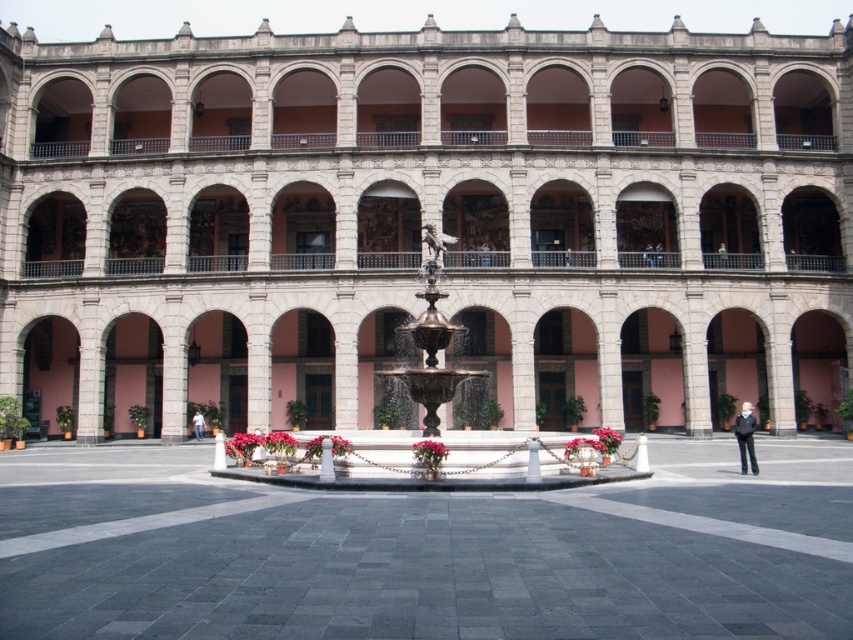
Who is higher up, bronze statue at center or red matte flower at center?

bronze statue at center is higher up.

Is bronze statue at center closer to the viewer compared to red matte flower at center?

No, bronze statue at center is behind red matte flower at center.

You are a GUI agent. You are given a task and a screenshot of the screen. Output one action in this format:
    pyautogui.click(x=<x>, y=<y>)
    Task: Click on the bronze statue at center
    The height and width of the screenshot is (640, 853).
    Given the screenshot: What is the action you would take?
    pyautogui.click(x=433, y=248)

Measure the distance from bronze/brass fountain at center to matte pink flowers at center.

The distance of bronze/brass fountain at center from matte pink flowers at center is 11.31 meters.

Which is in front, point (579, 467) or point (312, 456)?

Point (579, 467) is more forward.

Which is behind, point (604, 458) or point (332, 444)?

The point (604, 458) is more distant.

The image size is (853, 640). Identify the location of bronze/brass fountain at center. (431, 358).

Which of these two, bronze statue at center or matte pink flowers at center, stands taller?

With more height is bronze statue at center.

Is point (451, 241) positioned behind point (305, 445)?

Yes, point (451, 241) is behind point (305, 445).

Does point (428, 266) come closer to viewer compared to point (337, 452)?

That is False.

The image size is (853, 640). Find the location of `bronze statue at center`. bronze statue at center is located at coordinates (433, 248).